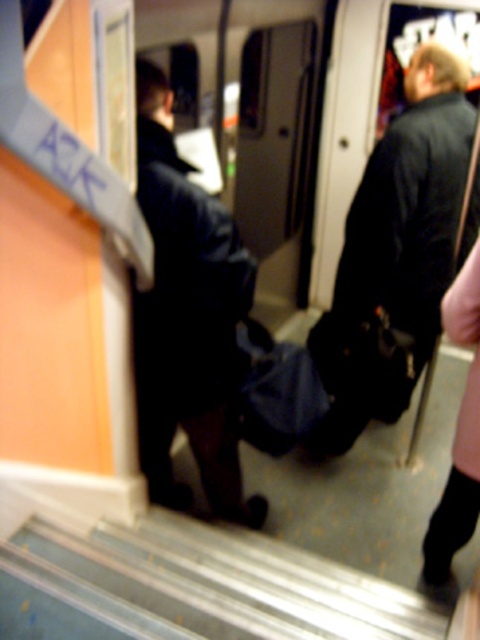
You are a passenger on a moving train and need to quickly exit through the door. There are metallic gray stairs at lower center and a black leather jacket at right. Which object is wider, allowing for a safer exit? Please explain.

The metallic gray stairs at lower center is wider than the black leather jacket at right, so exiting through the stairs would be safer due to their greater width.

You are a passenger on a moving train and you see the metallic gray stairs at lower center and the black leather jacket at center. Which object is closer to you?

The metallic gray stairs at lower center is closer to you because it is in front of the black leather jacket at center.